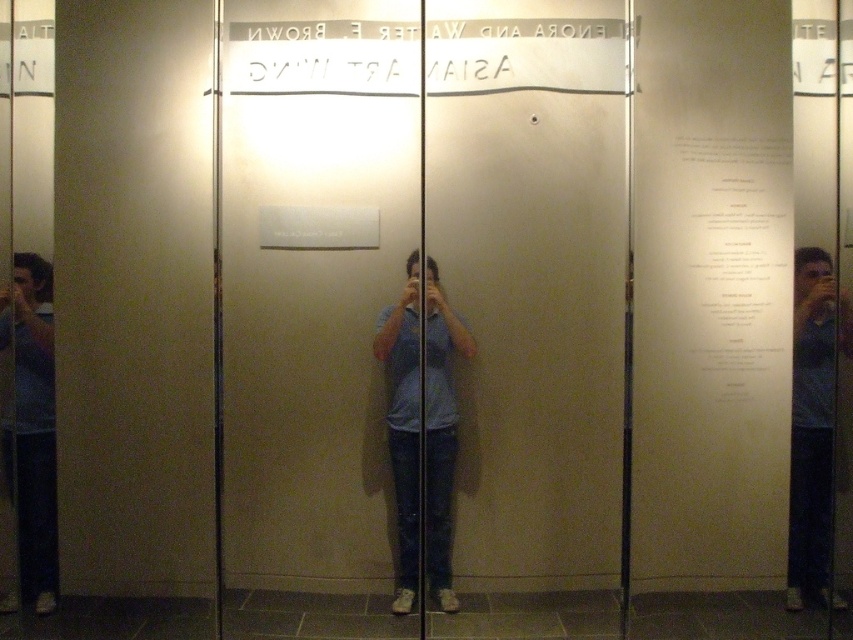
Question: Is transparent glass door at center wider than blue denim jeans at right?

Choices:
 (A) no
 (B) yes

Answer: (B)

Question: Which point is closer to the camera?

Choices:
 (A) click(x=405, y=499)
 (B) click(x=36, y=556)
 (C) click(x=817, y=392)
 (D) click(x=463, y=161)

Answer: (B)

Question: Is transparent glass door at center below blue denim jeans at right?

Choices:
 (A) yes
 (B) no

Answer: (B)

Question: Which of the following is the closest to the observer?

Choices:
 (A) pos(35,268)
 (B) pos(440,355)
 (C) pos(335,109)

Answer: (A)

Question: Among these points, which one is nearest to the camera?

Choices:
 (A) (x=19, y=360)
 (B) (x=442, y=586)
 (C) (x=500, y=605)
 (D) (x=786, y=592)

Answer: (A)

Question: Can you confirm if transparent glass door at center is positioned to the right of light blue fabric at center?

Choices:
 (A) yes
 (B) no

Answer: (B)